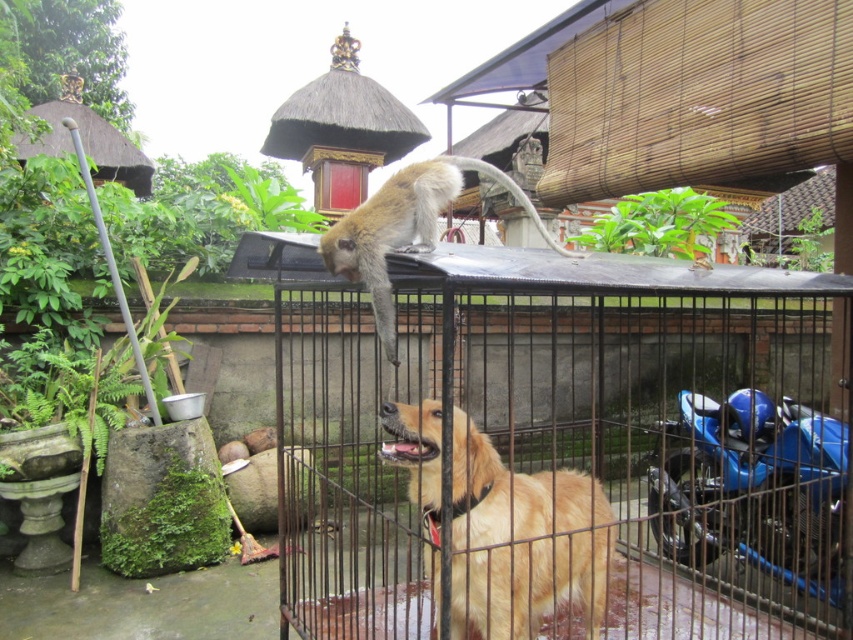
Question: Which point is closer to the camera taking this photo?

Choices:
 (A) (489, 570)
 (B) (543, 593)
 (C) (379, 310)

Answer: (C)

Question: Does black metal cage at center appear on the right side of golden fur monkey at upper center?

Choices:
 (A) no
 (B) yes

Answer: (B)

Question: Based on their relative distances, which object is farther from the golden fur dog at center?

Choices:
 (A) golden fur monkey at upper center
 (B) black metal cage at center

Answer: (A)

Question: Does black metal cage at center appear on the left side of golden fur dog at center?

Choices:
 (A) no
 (B) yes

Answer: (A)

Question: Which object is the farthest from the black metal cage at center?

Choices:
 (A) golden fur dog at center
 (B) golden fur monkey at upper center

Answer: (B)

Question: Does black metal cage at center have a smaller size compared to golden fur dog at center?

Choices:
 (A) yes
 (B) no

Answer: (A)